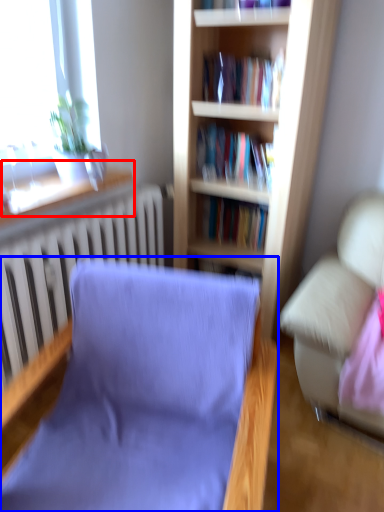
Question: Which object is further to the camera taking this photo, window sill (highlighted by a red box) or chair (highlighted by a blue box)?

Choices:
 (A) window sill
 (B) chair

Answer: (A)